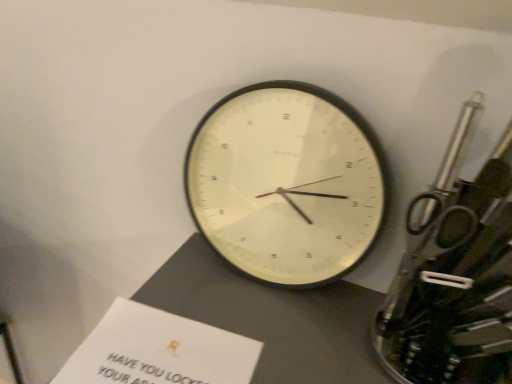
In order to face metallic scissors at right, should I rotate leftwards or rightwards?

Turn right approximately 28.675 degrees to face it.

The image size is (512, 384). Describe the element at coordinates (454, 273) in the screenshot. I see `metallic scissors at right` at that location.

Where is `metallic scissors at right`? Image resolution: width=512 pixels, height=384 pixels. metallic scissors at right is located at coordinates (454, 273).

Where is `metallic scissors at right`? This screenshot has height=384, width=512. metallic scissors at right is located at coordinates (454, 273).